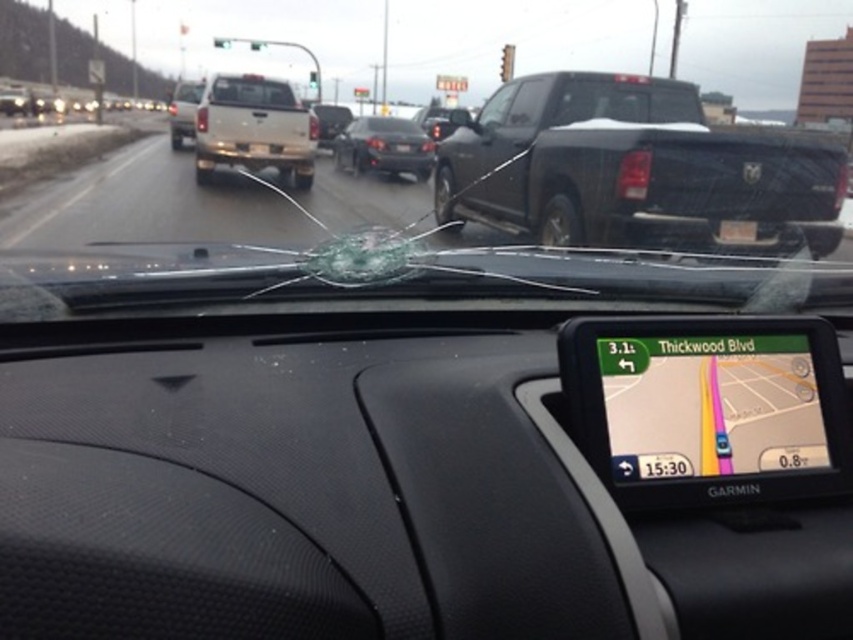
Question: Does matte white truck at upper center appear on the right side of silver metallic suv at upper center?

Choices:
 (A) no
 (B) yes

Answer: (B)

Question: Which of the following is the farthest from the observer?

Choices:
 (A) silver metallic suv at upper center
 (B) satin black sedan at center
 (C) matte white truck at upper center
 (D) black matte truck at upper right

Answer: (A)

Question: Observing the image, what is the correct spatial positioning of black matte truck at upper right in reference to silver metallic suv at upper center?

Choices:
 (A) right
 (B) left

Answer: (A)

Question: Which point is farther to the camera?

Choices:
 (A) silver metallic suv at upper center
 (B) black matte truck at upper right
 (C) matte white truck at upper center

Answer: (A)

Question: Which object is farther from the camera taking this photo?

Choices:
 (A) black matte truck at upper right
 (B) matte white truck at upper center

Answer: (B)

Question: Does matte white truck at upper center come in front of satin black sedan at center?

Choices:
 (A) yes
 (B) no

Answer: (A)